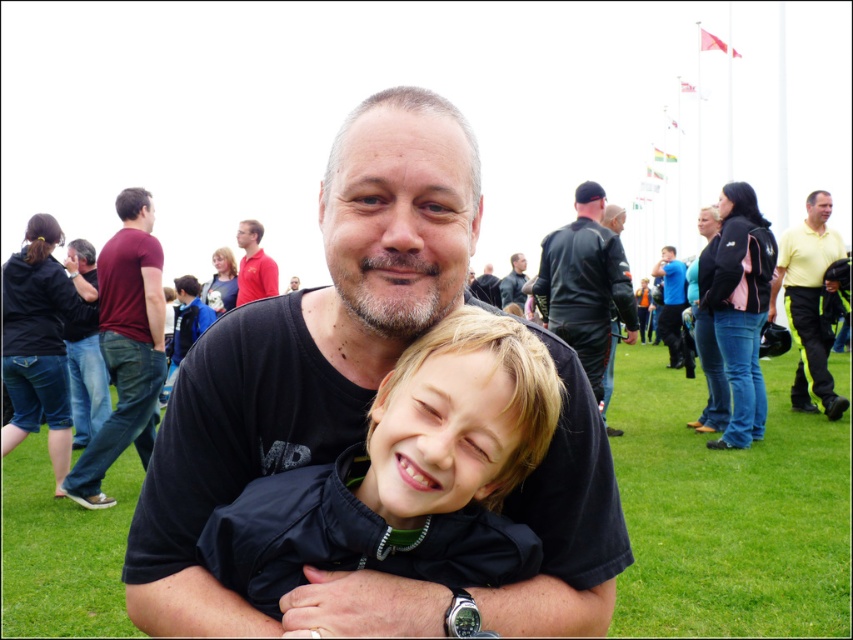
You are standing in the grassy field and want to locate the matte red shirt at upper left. According to the coordinates provided, where should you look?

You should look at point 0.416 on the x axis and 0.299 on the y axis to find the matte red shirt at upper left.

You are a photographer at the event and want to take a photo of both the matte red shirt at upper left and the black leather jacket at center. Can you see both objects in the frame without moving the camera?

The matte red shirt at upper left is in front of the black leather jacket at center, so yes, you can see both objects in the frame without moving the camera because the matte red shirt at upper left is positioned in front and the black leather jacket at center is behind it.